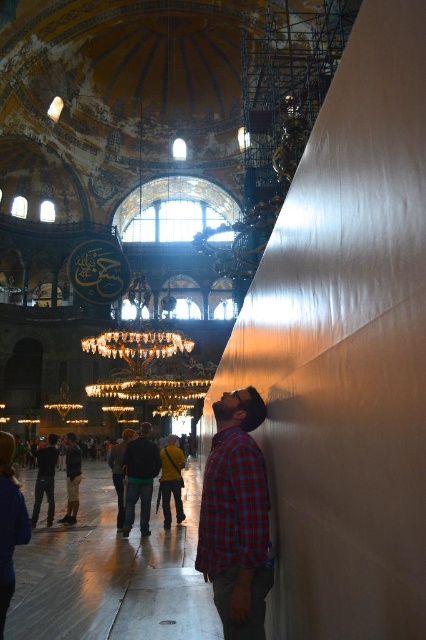
You are standing in the grand cathedral and want to place a small statue exactly halfway between the point at coordinates point (238, 449) and the point at coordinates point (51, 461). Will the statue be closer to the ceiling or the floor?

The statue placed halfway between point (238, 449) and point (51, 461) will be closer to the floor because the midpoint between these points is closer to the lower coordinate point (51, 461), which is lower in the image.